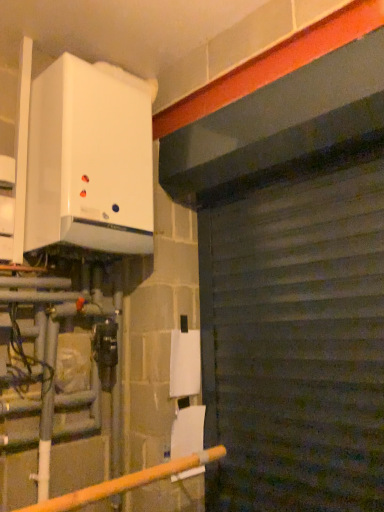
Question: Considering the positions of dark gray corrugated metal at center and yellow matte pipe at lower left in the image, is dark gray corrugated metal at center taller or shorter than yellow matte pipe at lower left?

Choices:
 (A) short
 (B) tall

Answer: (B)

Question: From a real-world perspective, is dark gray corrugated metal at center positioned above or below yellow matte pipe at lower left?

Choices:
 (A) above
 (B) below

Answer: (A)

Question: Based on their relative distances, which object is farther from the dark gray corrugated metal at center?

Choices:
 (A) white glossy boiler at upper left
 (B) yellow matte pipe at lower left

Answer: (A)

Question: Which object is positioned farthest from the dark gray corrugated metal at center?

Choices:
 (A) white glossy boiler at upper left
 (B) yellow matte pipe at lower left

Answer: (A)